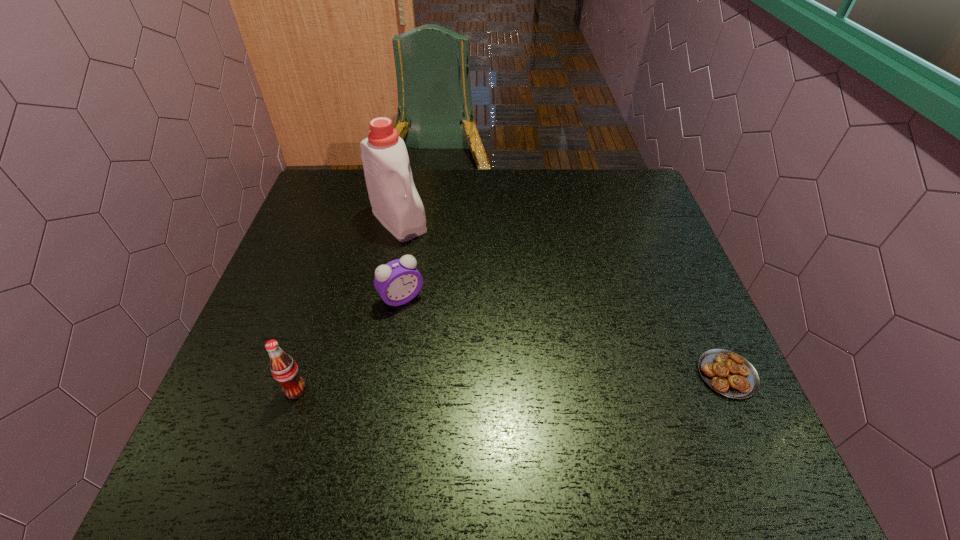
What are the coordinates of `vacant spot on the desktop that is between the soda and the pastry and is positioned on the handle side of the farthest object` in the screenshot? It's located at [x=550, y=381].

This screenshot has width=960, height=540. In order to click on vacant space on the desktop that is between the leftmost object and the rightmost object and is positioned on the face of the second shortest object in this screenshot , I will do `click(463, 384)`.